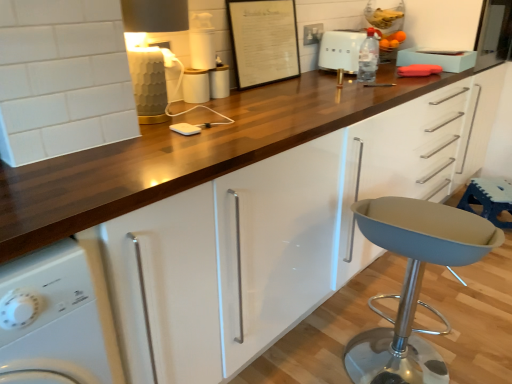
Question: Would you say white matte charger at center, the 1th appliance positioned from the bottom, contains white plastic container at upper center, which appears as the fourth appliance when ordered from the bottom?

Choices:
 (A) no
 (B) yes

Answer: (A)

Question: Is white matte charger at center, positioned as the fourth appliance in top-to-bottom order, positioned before white plastic container at upper center, which appears as the fourth appliance when ordered from the bottom?

Choices:
 (A) no
 (B) yes

Answer: (B)

Question: Is white matte charger at center, the 1th appliance positioned from the bottom, next to white plastic container at upper center, the 1th appliance in the top-to-bottom sequence, and touching it?

Choices:
 (A) yes
 (B) no

Answer: (B)

Question: Is white matte charger at center, positioned as the fourth appliance in top-to-bottom order, bigger than white plastic container at upper center, which appears as the fourth appliance when ordered from the bottom?

Choices:
 (A) no
 (B) yes

Answer: (A)

Question: Would you say white matte charger at center, the 1th appliance positioned from the bottom, is a long distance from white plastic container at upper center, the 1th appliance in the top-to-bottom sequence?

Choices:
 (A) no
 (B) yes

Answer: (A)

Question: Is white matte charger at center, positioned as the fourth appliance in top-to-bottom order, aimed at white plastic container at upper center, the 1th appliance in the top-to-bottom sequence?

Choices:
 (A) no
 (B) yes

Answer: (A)

Question: Considering the relative sizes of white glossy washing machine at lower left and white plastic container at upper center, the 1th appliance in the top-to-bottom sequence, in the image provided, is white glossy washing machine at lower left thinner than white plastic container at upper center, the 1th appliance in the top-to-bottom sequence,?

Choices:
 (A) no
 (B) yes

Answer: (A)

Question: Considering the relative sizes of white glossy washing machine at lower left and white plastic container at upper center, which appears as the fourth appliance when ordered from the bottom, in the image provided, is white glossy washing machine at lower left smaller than white plastic container at upper center, which appears as the fourth appliance when ordered from the bottom,?

Choices:
 (A) yes
 (B) no

Answer: (B)

Question: Does white glossy washing machine at lower left lie in front of white plastic container at upper center, the 1th appliance in the top-to-bottom sequence?

Choices:
 (A) yes
 (B) no

Answer: (A)

Question: From the image's perspective, does white glossy washing machine at lower left appear lower than white plastic container at upper center, the 1th appliance in the top-to-bottom sequence?

Choices:
 (A) no
 (B) yes

Answer: (B)

Question: Considering the relative sizes of white glossy washing machine at lower left and white plastic container at upper center, the 1th appliance in the top-to-bottom sequence, in the image provided, is white glossy washing machine at lower left shorter than white plastic container at upper center, the 1th appliance in the top-to-bottom sequence,?

Choices:
 (A) no
 (B) yes

Answer: (A)

Question: Can you confirm if white glossy washing machine at lower left is wider than white plastic container at upper center, which appears as the fourth appliance when ordered from the bottom?

Choices:
 (A) yes
 (B) no

Answer: (A)

Question: Is white glossy cup at center, which is the 2th appliance in bottom-to-top order, oriented away from blue fabric bar stool at lower right?

Choices:
 (A) yes
 (B) no

Answer: (B)